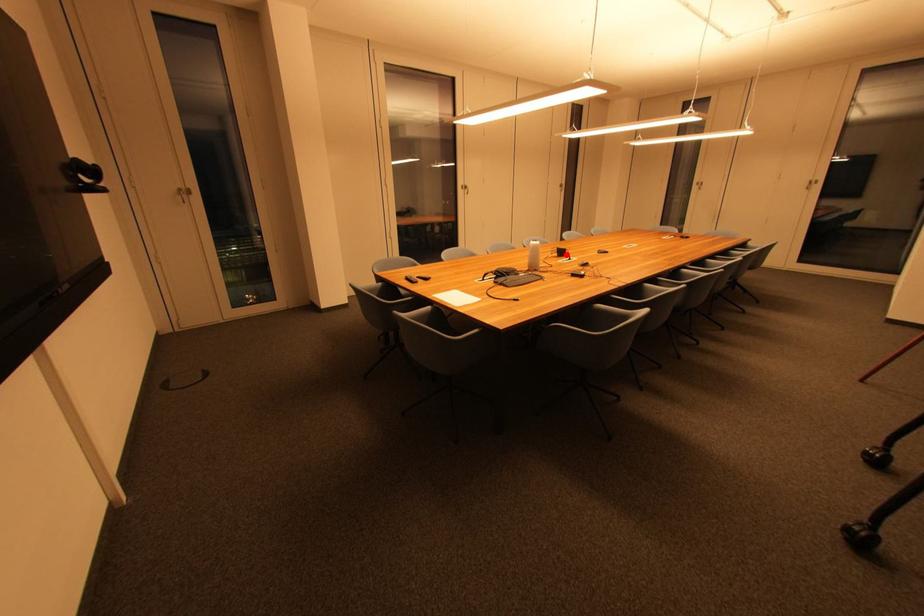
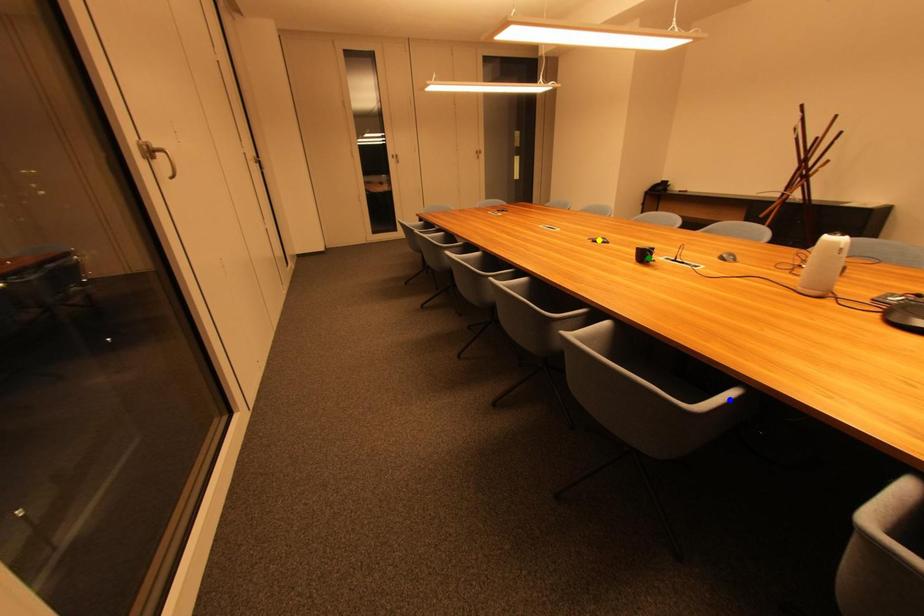
Question: I am providing you with two images of the same scene from different viewpoints. A red point is marked on the first image. You are given multiple points on the second image. Which mark in image 2 goes with the point in image 1?

Choices:
 (A) yellow point
 (B) green point
 (C) blue point

Answer: (B)